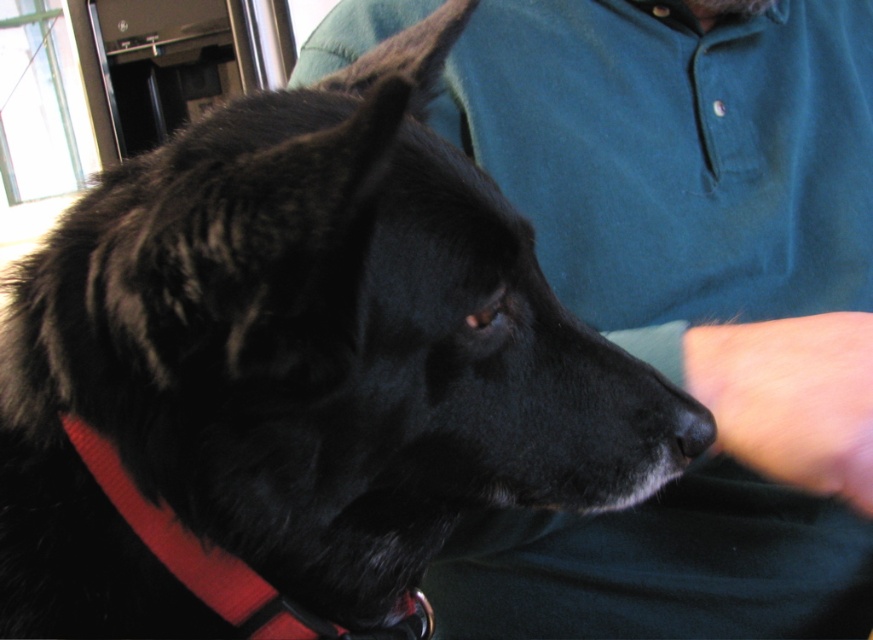
Measure the distance between smooth skin at lower right and red nylon collar at lower left.

smooth skin at lower right is 10.18 inches away from red nylon collar at lower left.

Can you confirm if smooth skin at lower right is positioned to the left of red nylon collar at lower left?

No, smooth skin at lower right is not to the left of red nylon collar at lower left.

Between point (751, 458) and point (303, 616), which one is positioned in front?

Positioned in front is point (303, 616).

Where is `smooth skin at lower right`? smooth skin at lower right is located at coordinates click(x=791, y=397).

Is green cotton shirt at upper center smaller than smooth skin at lower right?

No.

Can you confirm if green cotton shirt at upper center is shorter than smooth skin at lower right?

In fact, green cotton shirt at upper center may be taller than smooth skin at lower right.

Which is behind, point (856, 129) or point (765, 394)?

The point (856, 129) is more distant.

The height and width of the screenshot is (640, 873). I want to click on green cotton shirt at upper center, so click(688, 304).

Can you confirm if green cotton shirt at upper center is wider than red nylon collar at lower left?

Yes.

Which of these two, green cotton shirt at upper center or red nylon collar at lower left, stands shorter?

With less height is red nylon collar at lower left.

Does point (464, 115) lie behind point (84, 454)?

That is True.

Locate an element on the screen. green cotton shirt at upper center is located at coordinates (688, 304).